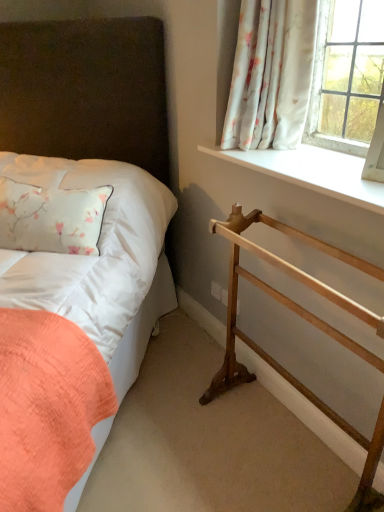
The height and width of the screenshot is (512, 384). Describe the element at coordinates (86, 90) in the screenshot. I see `matte white bed at left` at that location.

Locate an element on the screen. wooden towel rack at lower right is located at coordinates (310, 323).

Measure the distance between white smooth window sill at upper right and camera.

The depth of white smooth window sill at upper right is 1.24 meters.

This screenshot has width=384, height=512. What do you see at coordinates (311, 172) in the screenshot?
I see `white smooth window sill at upper right` at bounding box center [311, 172].

Locate an element on the screen. This screenshot has width=384, height=512. white floral fabric at upper right is located at coordinates (271, 74).

In terms of width, does white satin pillow at left look wider or thinner when compared to matte white bed at left?

Considering their sizes, white satin pillow at left looks slimmer than matte white bed at left.

What are the coordinates of `bed below the white satin pillow at left (from the image's perspective)` in the screenshot? It's located at (86, 90).

Between white satin pillow at left and matte white bed at left, which one has smaller size?

Smaller between the two is white satin pillow at left.

Can you tell me how much white satin pillow at left and matte white bed at left differ in facing direction?

0.000818 degrees.

Between wooden towel rack at lower right and matte white bed at left, which one has more height?

With more height is matte white bed at left.

From the image's perspective, is wooden towel rack at lower right above matte white bed at left?

Incorrect, from the image's perspective, wooden towel rack at lower right is lower than matte white bed at left.

Are wooden towel rack at lower right and matte white bed at left located far from each other?

Yes, wooden towel rack at lower right and matte white bed at left are located far from each other.

Is wooden towel rack at lower right outside of matte white bed at left?

Absolutely, wooden towel rack at lower right is external to matte white bed at left.

Is white smooth window sill at upper right far from wooden towel rack at lower right?

They are positioned close to each other.

Is white smooth window sill at upper right looking in the opposite direction of wooden towel rack at lower right?

No.

Would you say white smooth window sill at upper right contains wooden towel rack at lower right?

No, wooden towel rack at lower right is not a part of white smooth window sill at upper right.

Which object is wider, white smooth window sill at upper right or wooden towel rack at lower right?

Wider between the two is white smooth window sill at upper right.

Would you say white satin pillow at left is outside wooden towel rack at lower right?

Yes, white satin pillow at left is not within wooden towel rack at lower right.

Based on the photo, is white satin pillow at left looking in the opposite direction of wooden towel rack at lower right?

No, wooden towel rack at lower right is not at the back of white satin pillow at left.

Does white satin pillow at left lie in front of wooden towel rack at lower right?

No, it is not.

This screenshot has height=512, width=384. In order to click on balustrade below the matte white bed at left (from a real-world perspective) in this screenshot , I will do `click(310, 323)`.

Between matte white bed at left and wooden towel rack at lower right, which one has smaller width?

Thinner between the two is wooden towel rack at lower right.

Can you confirm if matte white bed at left is positioned to the right of wooden towel rack at lower right?

Incorrect, matte white bed at left is not on the right side of wooden towel rack at lower right.

Considering the sizes of objects matte white bed at left and wooden towel rack at lower right in the image provided, who is smaller, matte white bed at left or wooden towel rack at lower right?

With smaller size is wooden towel rack at lower right.

From the image's perspective, between matte white bed at left and white floral fabric at upper right, who is located below?

matte white bed at left appears lower in the image.

Are matte white bed at left and white floral fabric at upper right beside each other?

No, matte white bed at left is not with white floral fabric at upper right.

Does matte white bed at left have a lesser height compared to white floral fabric at upper right?

No, matte white bed at left is not shorter than white floral fabric at upper right.

Is matte white bed at left oriented away from white floral fabric at upper right?

No, matte white bed at left is not facing away from white floral fabric at upper right.

Based on the photo, who is taller, matte white bed at left or white smooth window sill at upper right?

matte white bed at left is taller.

Is matte white bed at left bigger or smaller than white smooth window sill at upper right?

Clearly, matte white bed at left is larger in size than white smooth window sill at upper right.

Would you say matte white bed at left contains white smooth window sill at upper right?

Actually, white smooth window sill at upper right is outside matte white bed at left.

Considering the sizes of objects matte white bed at left and white smooth window sill at upper right in the image provided, who is thinner, matte white bed at left or white smooth window sill at upper right?

white smooth window sill at upper right is thinner.

Locate an element on the screen. Image resolution: width=384 pixels, height=512 pixels. bed in front of the white satin pillow at left is located at coordinates (86, 90).

Locate an element on the screen. Image resolution: width=384 pixels, height=512 pixels. balustrade on the right of the matte white bed at left is located at coordinates (310, 323).

When comparing their distances from matte white bed at left, does white smooth window sill at upper right or wooden towel rack at lower right seem closer?

white smooth window sill at upper right is closer to matte white bed at left.

Based on their spatial positions, is white satin pillow at left or wooden towel rack at lower right further from white smooth window sill at upper right?

The object further to white smooth window sill at upper right is white satin pillow at left.

Considering their positions, is white floral fabric at upper right positioned further to white smooth window sill at upper right than matte white bed at left?

matte white bed at left is positioned further to the anchor white smooth window sill at upper right.

Considering their positions, is white satin pillow at left positioned closer to matte white bed at left than white smooth window sill at upper right?

white satin pillow at left is positioned closer to the anchor matte white bed at left.

Which object lies further to the anchor point matte white bed at left, wooden towel rack at lower right or white floral fabric at upper right?

wooden towel rack at lower right lies further to matte white bed at left than the other object.

Considering their positions, is white satin pillow at left positioned further to matte white bed at left than wooden towel rack at lower right?

wooden towel rack at lower right lies further to matte white bed at left than the other object.

Based on their spatial positions, is white smooth window sill at upper right or matte white bed at left closer to white floral fabric at upper right?

white smooth window sill at upper right is positioned closer to the anchor white floral fabric at upper right.

Based on their spatial positions, is white floral fabric at upper right or wooden towel rack at lower right closer to white satin pillow at left?

The object closer to white satin pillow at left is wooden towel rack at lower right.

Locate an element on the screen. window sill between white floral fabric at upper right and wooden towel rack at lower right vertically is located at coordinates (311, 172).

Where is `curtain between matte white bed at left and wooden towel rack at lower right in the horizontal direction`? curtain between matte white bed at left and wooden towel rack at lower right in the horizontal direction is located at coordinates (271, 74).

Identify the location of curtain between white satin pillow at left and wooden towel rack at lower right from left to right. [271, 74].

Where is `balustrade between matte white bed at left and white smooth window sill at upper right from left to right`? balustrade between matte white bed at left and white smooth window sill at upper right from left to right is located at coordinates (310, 323).